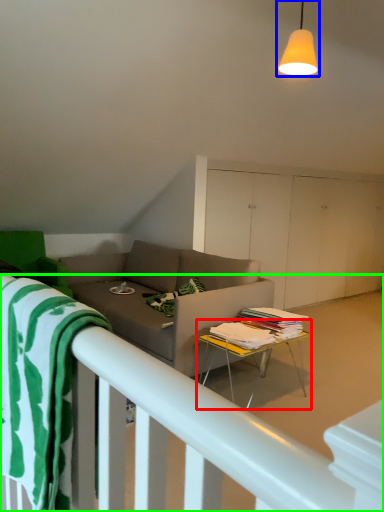
Question: Which object is positioned farthest from table (highlighted by a red box)? Select from light fixture (highlighted by a blue box) and bed frame (highlighted by a green box).

Choices:
 (A) light fixture
 (B) bed frame

Answer: (B)